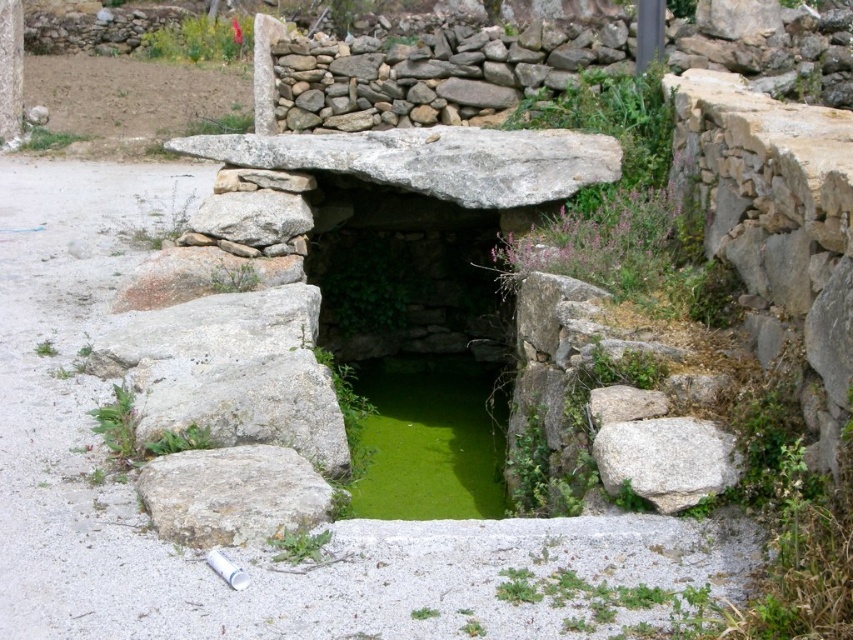
Between green algae at center and gray rough stone at lower left, which one has less height?

Standing shorter between the two is green algae at center.

Between green algae at center and gray rough stone at lower left, which one is positioned higher?

gray rough stone at lower left

Is point (450, 490) farther from viewer compared to point (227, 464)?

That is True.

You are a GUI agent. You are given a task and a screenshot of the screen. Output one action in this format:
    pyautogui.click(x=<x>, y=<y>)
    Task: Click on the green algae at center
    The width and height of the screenshot is (853, 640).
    Given the screenshot: What is the action you would take?
    pyautogui.click(x=427, y=440)

Which is more to the left, green algae at center or gray rough rock at right?

From the viewer's perspective, green algae at center appears more on the left side.

Is point (361, 422) closer to viewer compared to point (674, 428)?

No.

The image size is (853, 640). Identify the location of green algae at center. (427, 440).

Consider the image. Does gray rough stone at lower left appear under gray rough rock at right?

Indeed, gray rough stone at lower left is positioned under gray rough rock at right.

Consider the image. Does gray rough stone at lower left appear over gray rough rock at right?

Incorrect, gray rough stone at lower left is not positioned above gray rough rock at right.

Which is behind, point (216, 486) or point (627, 424)?

The point (627, 424) is behind.

This screenshot has height=640, width=853. Find the location of `gray rough stone at lower left`. gray rough stone at lower left is located at coordinates (231, 493).